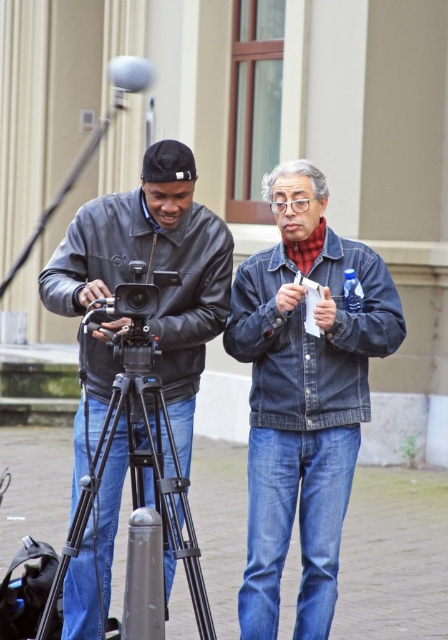
Can you confirm if denim jacket at center is bigger than black leather jacket at left?

Correct, denim jacket at center is larger in size than black leather jacket at left.

Is denim jacket at center wider than black leather jacket at left?

Indeed, denim jacket at center has a greater width compared to black leather jacket at left.

Which is in front, point (261, 349) or point (185, 218)?

Point (261, 349) is more forward.

Identify the location of denim jacket at center. The image size is (448, 640). (304, 396).